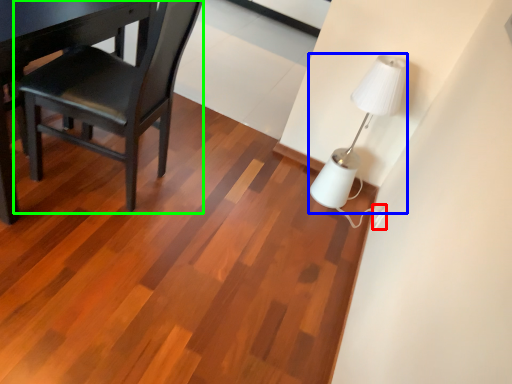
Question: Considering the real-world distances, which object is closest to electric outlet (highlighted by a red box)? lamp (highlighted by a blue box) or chair (highlighted by a green box).

Choices:
 (A) lamp
 (B) chair

Answer: (A)